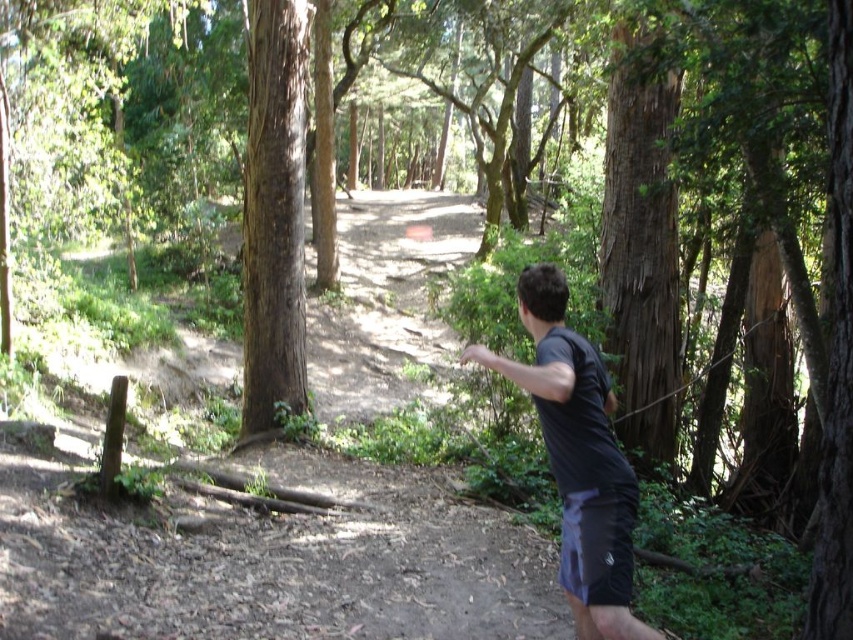
Does dark gray t-shirt at center have a smaller size compared to brown rough bark tree at center?

Yes, dark gray t-shirt at center is smaller than brown rough bark tree at center.

Measure the distance between dark gray t-shirt at center and camera.

3.19 meters

Identify the location of dark gray t-shirt at center. (577, 458).